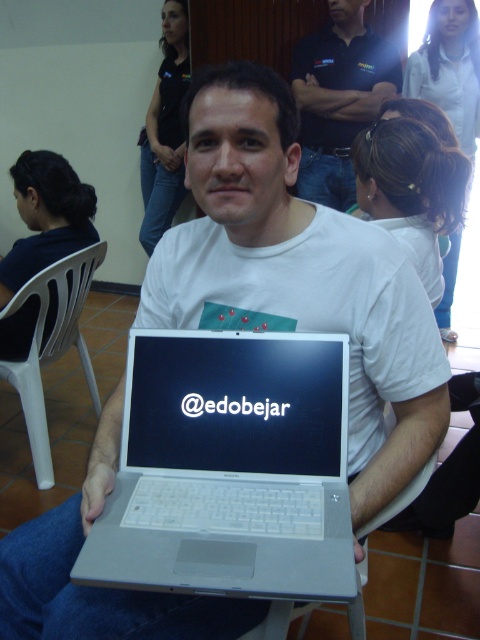
Is silver metallic laptop at center smaller than black shirt at upper center?

Correct, silver metallic laptop at center occupies less space than black shirt at upper center.

Is silver metallic laptop at center to the right of black shirt at upper center from the viewer's perspective?

Correct, you'll find silver metallic laptop at center to the right of black shirt at upper center.

Identify the location of silver metallic laptop at center. (229, 468).

Can you confirm if white plastic chair at lower left is positioned above black shirt at upper center?

Actually, white plastic chair at lower left is below black shirt at upper center.

From the picture: Is white plastic chair at lower left positioned before black shirt at upper center?

Yes, it is.

Find the location of a particular element. This screenshot has height=640, width=480. white plastic chair at lower left is located at coordinates (51, 346).

Is matte white hair at upper center in front of white plastic chair at lower center?

No, matte white hair at upper center is further to the viewer.

Identify the location of matte white hair at upper center. Image resolution: width=480 pixels, height=640 pixels. (450, 67).